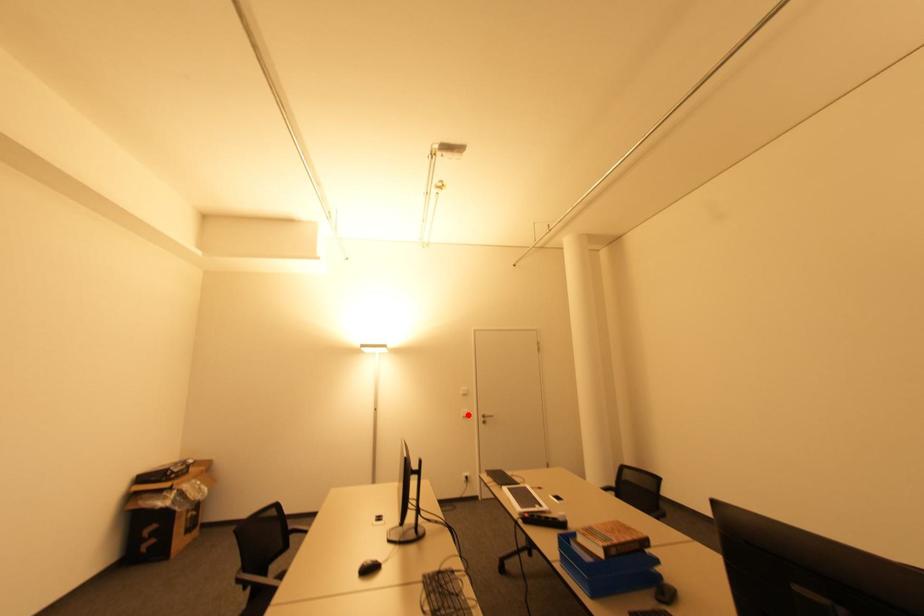
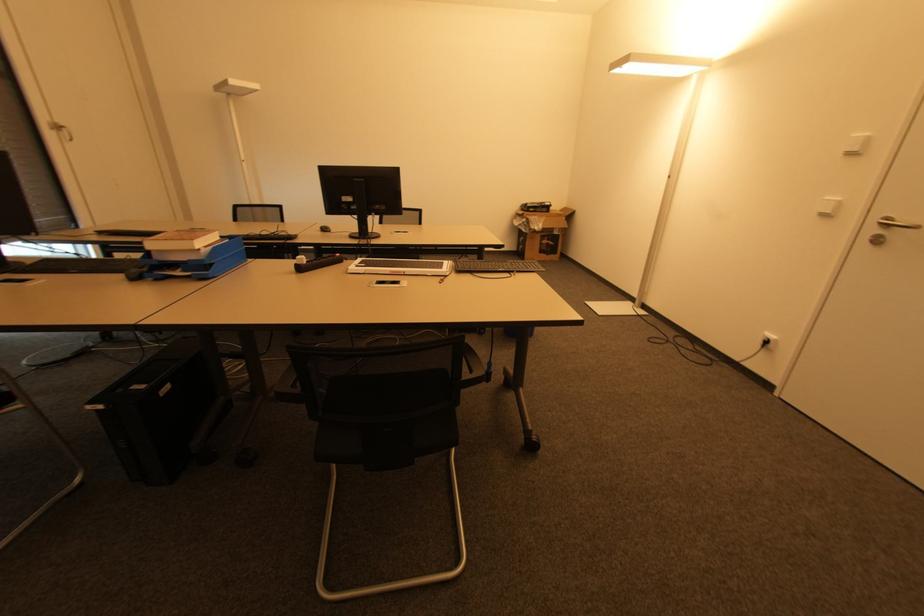
In the second image, find the point that corresponds to the highlighted location in the first image.

(832, 214)